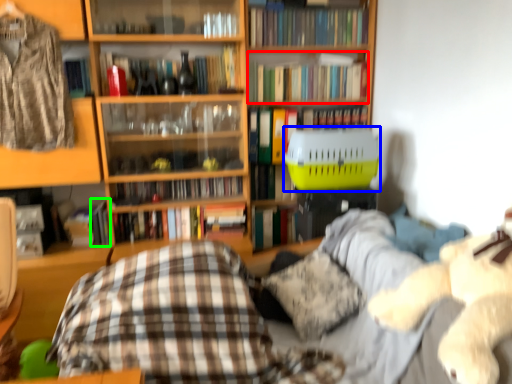
Question: Estimate the real-world distances between objects in this image. Which object is farther from book (highlighted by a red box), basket (highlighted by a blue box) or book (highlighted by a green box)?

Choices:
 (A) basket
 (B) book

Answer: (B)